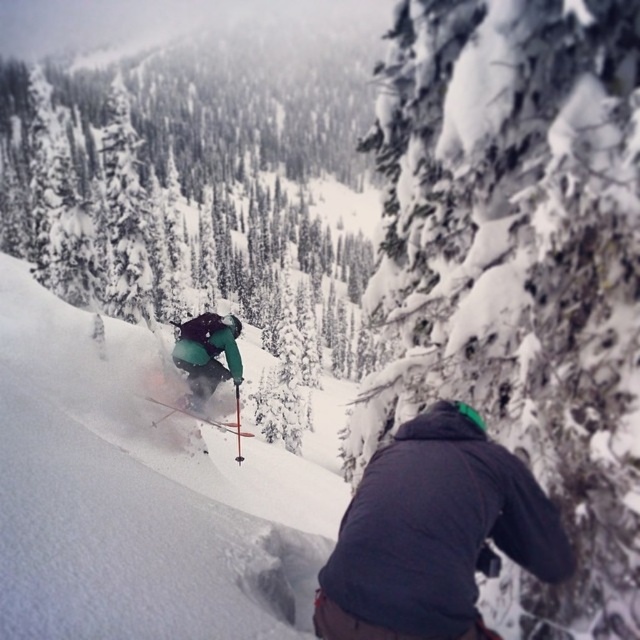
Question: In this image, where is snowy bark tree at center located relative to shiny metallic ski at center?

Choices:
 (A) below
 (B) above

Answer: (B)

Question: Can you confirm if snowy bark tree at center is bigger than shiny metallic ski at center?

Choices:
 (A) no
 (B) yes

Answer: (B)

Question: Which is farther from the snowy bark tree at center?

Choices:
 (A) powder snow ski slope at center
 (B) green matte tree at center
 (C) dark gray jacket at lower center

Answer: (B)

Question: Which object appears closest to the camera in this image?

Choices:
 (A) green matte jacket at center
 (B) snowy bark tree at center

Answer: (B)

Question: Can you confirm if snowy bark tree at center is bigger than powder snow ski slope at center?

Choices:
 (A) yes
 (B) no

Answer: (B)

Question: Among these objects, which one is farthest from the camera?

Choices:
 (A) green matte jacket at center
 (B) shiny metallic ski at center
 (C) powder snow ski slope at center
 (D) dark gray jacket at lower center

Answer: (B)